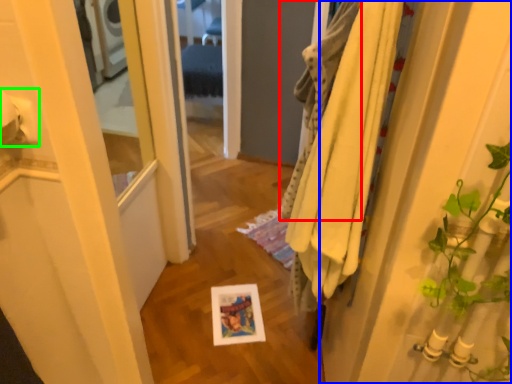
Question: Which is nearer to the bath towel (highlighted by a red box)? door (highlighted by a blue box) or toilet paper (highlighted by a green box).

Choices:
 (A) door
 (B) toilet paper

Answer: (A)